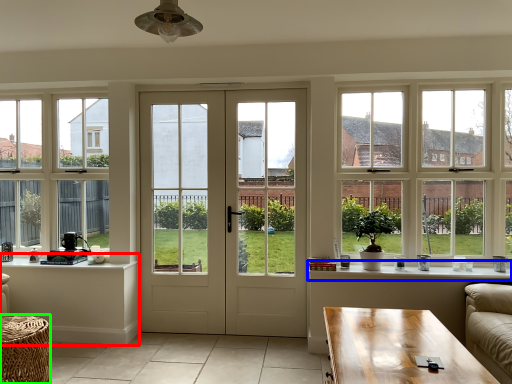
Question: Considering the real-world distances, which object is closest to table (highlighted by a red box)? window sill (highlighted by a blue box) or table (highlighted by a green box).

Choices:
 (A) window sill
 (B) table

Answer: (B)